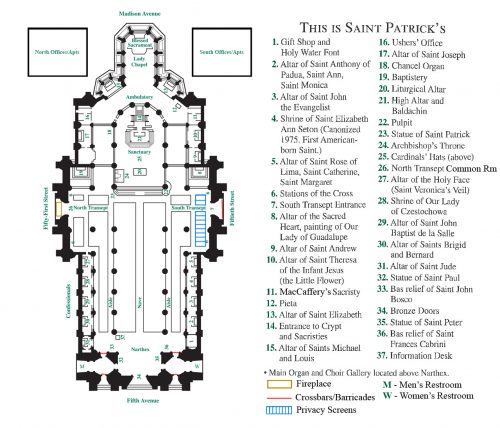
Find the location of a particular element. entrances is located at coordinates (197, 367).